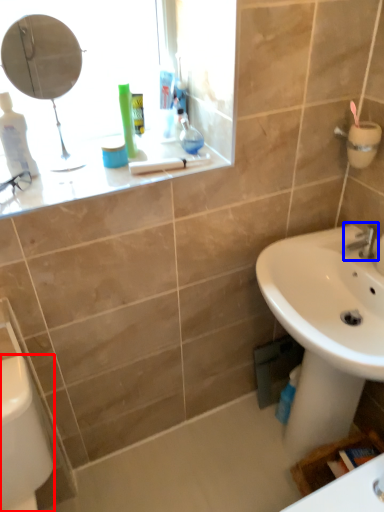
Question: Among these objects, which one is farthest to the camera, porcelain (highlighted by a red box) or tap (highlighted by a blue box)?

Choices:
 (A) porcelain
 (B) tap

Answer: (B)